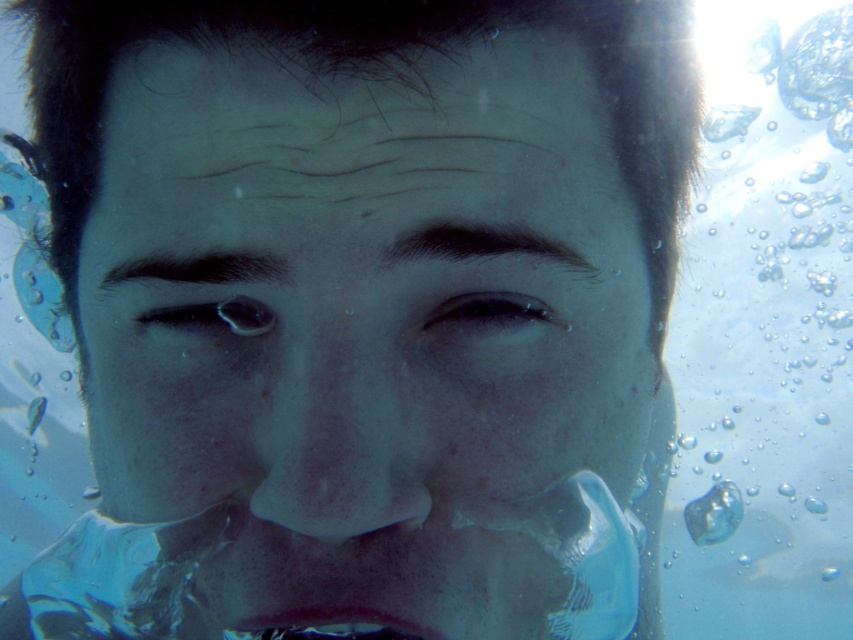
You are a photographer adjusting the focus on your camera. You want to ensure both the matte skin face at center and the smooth skin nose at center are in sharp focus. Given that your camera can only focus on objects within a 1.5 inch range, will both areas be in focus?

The matte skin face at center is 1.75 inches from the smooth skin nose at center. Since the distance between them exceeds the camera focus range of 1.5 inches, both areas cannot be in focus simultaneously.

Looking at this image, you are a photographer trying to capture the exact position of the subject in the image. Based on the scene, where is the matte skin face at center relative to the translucent blue lips at lower center?

The matte skin face at center is to the right of the translucent blue lips at lower center.